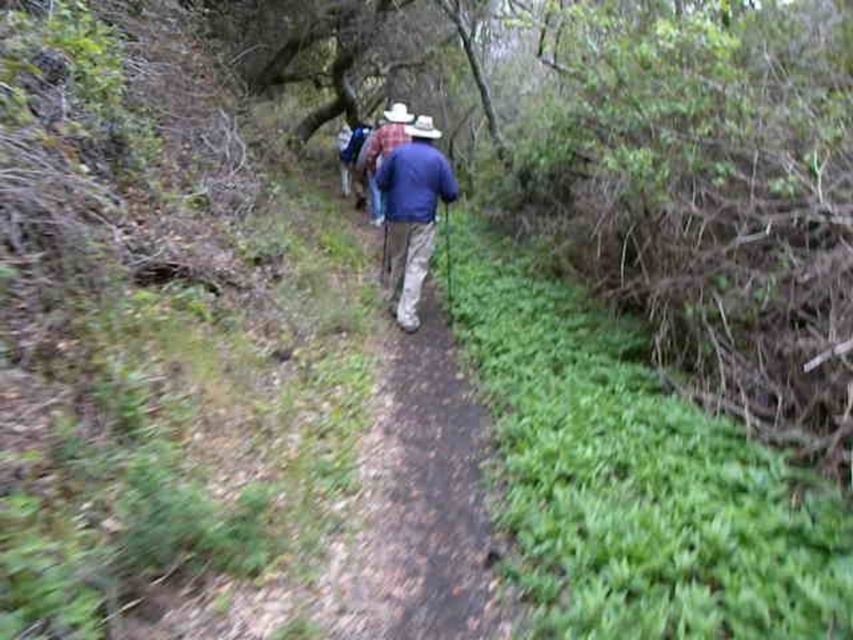
You are hiking along the brown dirt path at center and need to reach a cabin located at coordinates approximately 0.8, 0.5. Based on the path description, will you stay on the path to reach the cabin?

Yes, the brown dirt path at center is located at point approximately (426, 512), so you can stay on the path to reach the cabin.

You are standing at the edge of the forest and see the brown dirt path at center and the blue fabric jacket at center. Which object is closer to you?

The brown dirt path at center is closer to the viewer than the blue fabric jacket at center.